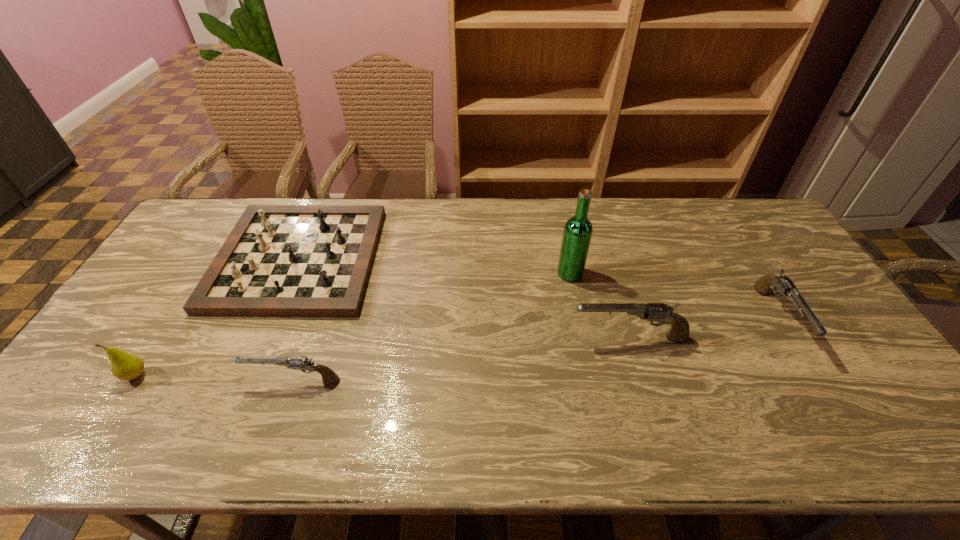
Identify the location of the shortest gun. (302, 363).

This screenshot has height=540, width=960. What are the coordinates of `the leftmost gun` in the screenshot? It's located at (302, 363).

The width and height of the screenshot is (960, 540). I want to click on the second gun from right to left, so (659, 312).

Identify the location of the rightmost object. (783, 284).

I want to click on the rightmost gun, so click(x=783, y=284).

Find the location of a particular element. chessboard is located at coordinates (279, 260).

At what (x,y) coordinates should I click in order to perform the action: click on the leftmost object. Please return your answer as a coordinate pair (x, y). The image size is (960, 540). Looking at the image, I should click on (126, 366).

Identify the location of the tallest object. This screenshot has height=540, width=960. click(577, 234).

Identify the location of vacant space located 0.230m aiming along the barrel of the leftmost gun. (156, 380).

The height and width of the screenshot is (540, 960). I want to click on vacant space located 0.280m aiming along the barrel of the leftmost gun, so click(136, 380).